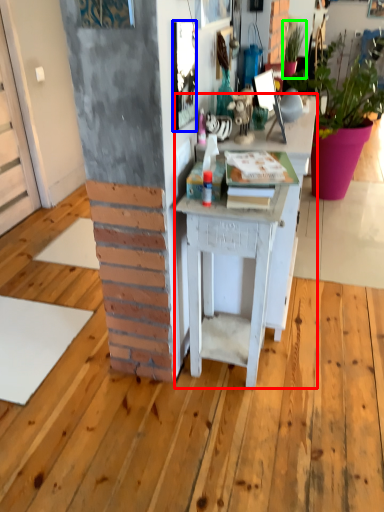
Question: Which is nearer to the desk (highlighted by a red box)? picture frame (highlighted by a blue box) or houseplant (highlighted by a green box).

Choices:
 (A) picture frame
 (B) houseplant

Answer: (A)